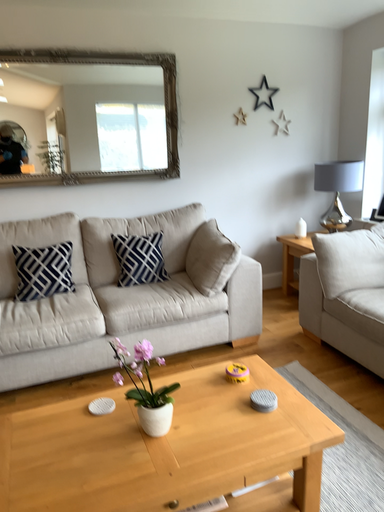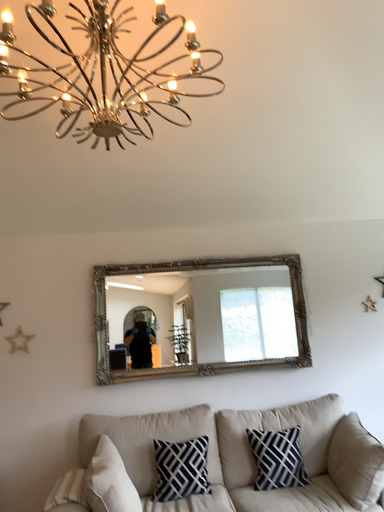
Question: How did the camera likely rotate when shooting the video?

Choices:
 (A) rotated left
 (B) rotated right

Answer: (A)